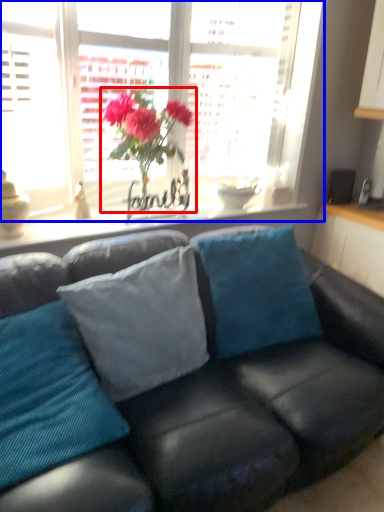
Question: Which of the following is the closest to the observer, houseplant (highlighted by a red box) or window (highlighted by a blue box)?

Choices:
 (A) houseplant
 (B) window

Answer: (B)